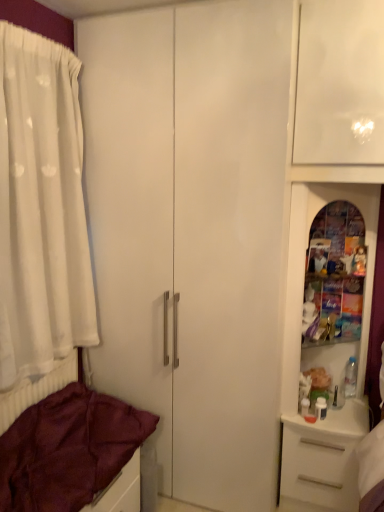
What do you see at coordinates (41, 208) in the screenshot? This screenshot has height=512, width=384. I see `white sheer curtain at left` at bounding box center [41, 208].

Where is `white sheer curtain at left`? white sheer curtain at left is located at coordinates (41, 208).

Who is taller, white plastic drawer at lower right or white sheer curtain at left?

Standing taller between the two is white sheer curtain at left.

From the image's perspective, is white plastic drawer at lower right on white sheer curtain at left?

No.

From a real-world perspective, does white plastic drawer at lower right stand above white sheer curtain at left?

No, from a real-world perspective, white plastic drawer at lower right is not above white sheer curtain at left.

From the image's perspective, is maroon fabric bed at lower left on white plastic drawer at lower right?

Yes, from the image's perspective, maroon fabric bed at lower left is over white plastic drawer at lower right.

Is maroon fabric bed at lower left placed right next to white plastic drawer at lower right?

maroon fabric bed at lower left is not next to white plastic drawer at lower right, and they're not touching.

How different are the orientations of maroon fabric bed at lower left and white plastic drawer at lower right in degrees?

88.2 degrees separate the facing orientations of maroon fabric bed at lower left and white plastic drawer at lower right.

Can you confirm if maroon fabric bed at lower left is thinner than white plastic drawer at lower right?

Incorrect, the width of maroon fabric bed at lower left is not less than that of white plastic drawer at lower right.

Which is more to the left, white sheer curtain at left or maroon fabric bed at lower left?

Positioned to the left is white sheer curtain at left.

Which of these two, white sheer curtain at left or maroon fabric bed at lower left, stands shorter?

maroon fabric bed at lower left.

The image size is (384, 512). Identify the location of bed below the white sheer curtain at left (from a real-world perspective). (69, 446).

Is white sheer curtain at left looking in the opposite direction of maroon fabric bed at lower left?

That's not correct — white sheer curtain at left is not looking away from maroon fabric bed at lower left.

Looking at this image, from a real-world perspective, is white plastic drawer at lower right positioned above or below maroon fabric bed at lower left?

white plastic drawer at lower right is below maroon fabric bed at lower left.

Does white plastic drawer at lower right come behind maroon fabric bed at lower left?

Yes, white plastic drawer at lower right is further from the viewer.

Is point (352, 442) behind point (124, 476)?

Yes, it is behind point (124, 476).

From the image's perspective, which object appears higher, white plastic drawer at lower right or maroon fabric bed at lower left?

maroon fabric bed at lower left is shown above in the image.

Is white sheer curtain at left wider than white plastic drawer at lower right?

No, white sheer curtain at left is not wider than white plastic drawer at lower right.

Based on the photo, from a real-world perspective, which object stands above the other?

white sheer curtain at left, from a real-world perspective.

Can you see white sheer curtain at left touching white plastic drawer at lower right?

No, white sheer curtain at left is not in contact with white plastic drawer at lower right.

Is white sheer curtain at left taller than white plastic drawer at lower right?

Yes.

Which is nearer, (110, 396) or (1, 343)?

Point (1, 343)

Is maroon fabric bed at lower left thinner than white sheer curtain at left?

Incorrect, the width of maroon fabric bed at lower left is not less than that of white sheer curtain at left.

Is maroon fabric bed at lower left in contact with white sheer curtain at left?

They are not placed beside each other.

Is maroon fabric bed at lower left to the left of white sheer curtain at left from the viewer's perspective?

In fact, maroon fabric bed at lower left is to the right of white sheer curtain at left.

Where is `curtain above the white plastic drawer at lower right (from a real-world perspective)`? This screenshot has width=384, height=512. curtain above the white plastic drawer at lower right (from a real-world perspective) is located at coordinates (41, 208).

Find the location of a particular element. The width and height of the screenshot is (384, 512). drawer behind the maroon fabric bed at lower left is located at coordinates (318, 468).

From the image, which object appears to be farther from maroon fabric bed at lower left, white plastic drawer at lower right or white sheer curtain at left?

white plastic drawer at lower right.

Estimate the real-world distances between objects in this image. Which object is closer to white sheer curtain at left, maroon fabric bed at lower left or white plastic drawer at lower right?

maroon fabric bed at lower left is closer to white sheer curtain at left.

Which object lies further to the anchor point white plastic drawer at lower right, white sheer curtain at left or maroon fabric bed at lower left?

white sheer curtain at left is positioned further to the anchor white plastic drawer at lower right.

From the image, which object appears to be nearer to white sheer curtain at left, white plastic drawer at lower right or maroon fabric bed at lower left?

maroon fabric bed at lower left.

From the image, which object appears to be farther from maroon fabric bed at lower left, white sheer curtain at left or white plastic drawer at lower right?

white plastic drawer at lower right.

Estimate the real-world distances between objects in this image. Which object is closer to white plastic drawer at lower right, maroon fabric bed at lower left or white sheer curtain at left?

Among the two, maroon fabric bed at lower left is located nearer to white plastic drawer at lower right.

Find the location of a particular element. This screenshot has width=384, height=512. bed between white sheer curtain at left and white plastic drawer at lower right is located at coordinates (69, 446).